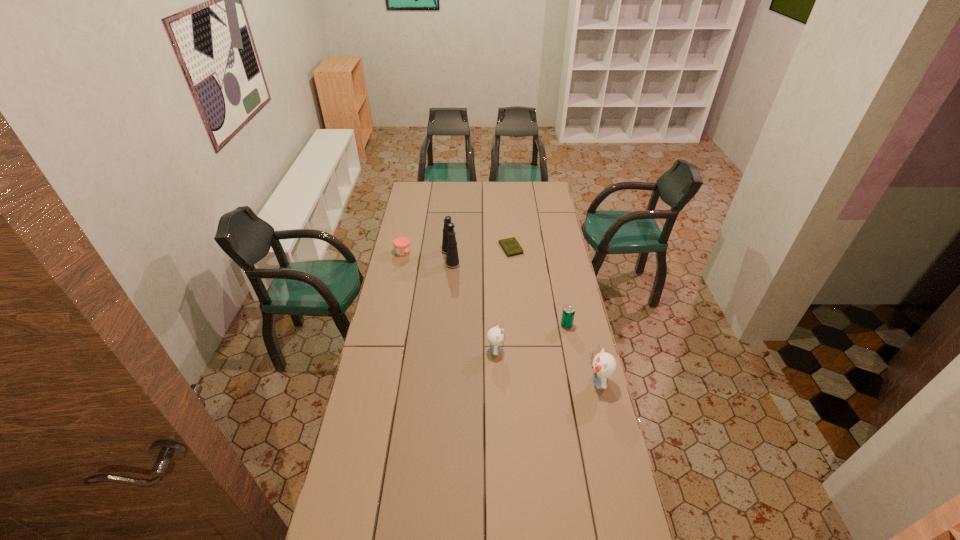
Given the evenly spaced kittens in the image, where should an extra kitten be added on the left to preserve the spacing? Please point to a vacant space. Please provide its 2D coordinates. Your answer should be formatted as a tuple, i.e. [(x, y)], where the tuple contains the x and y coordinates of a point satisfying the conditions above.

[(404, 323)]